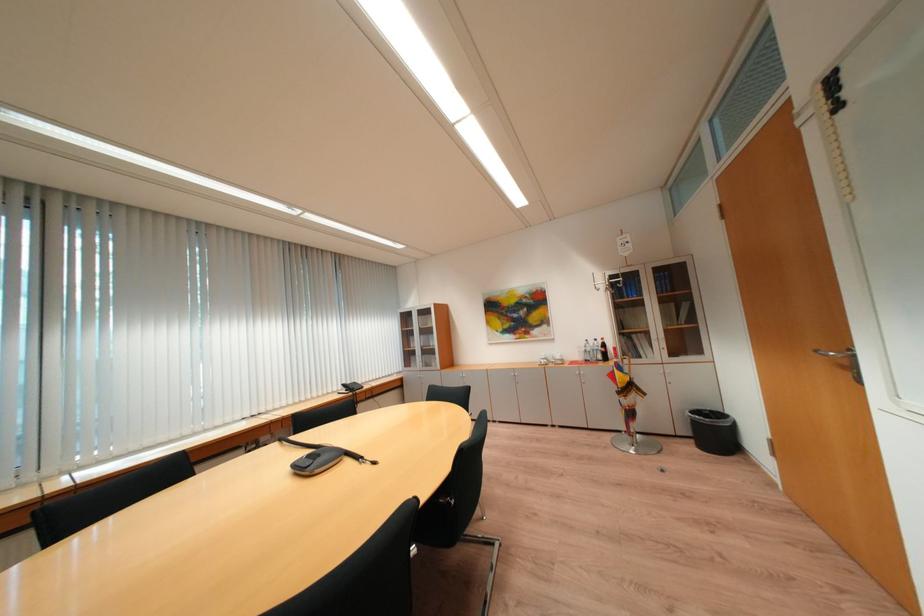
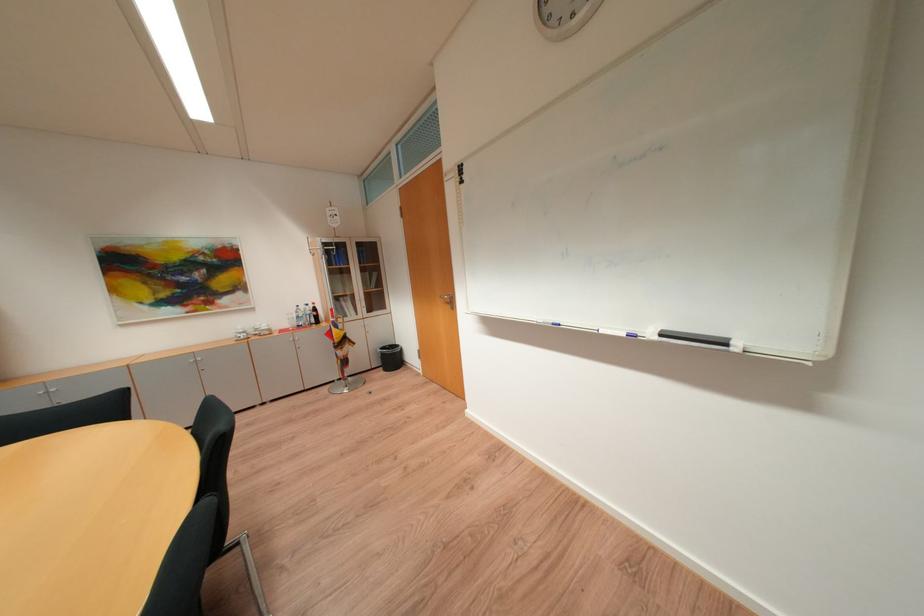
Where in the second image is the point corresponding to the point at 600,342 from the first image?

(310, 309)